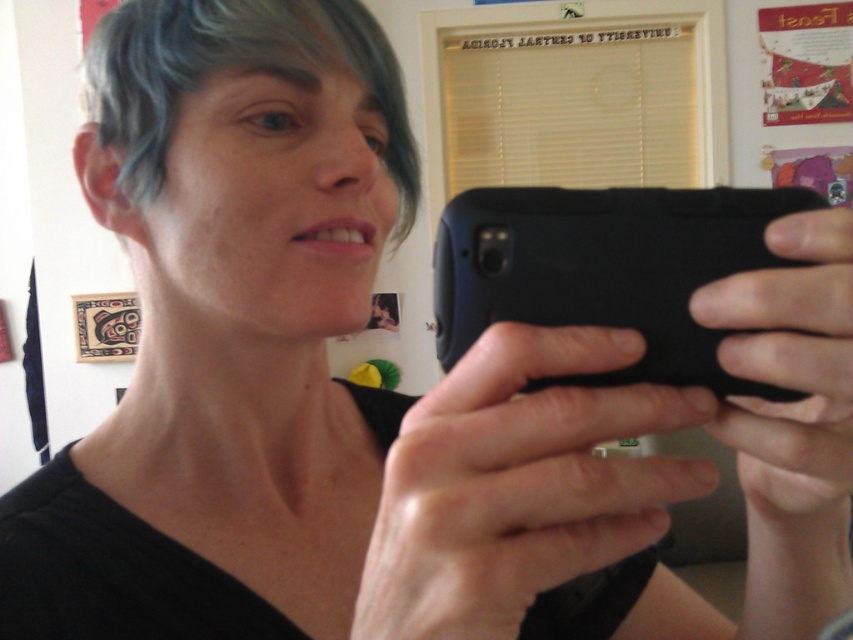
You are trying to locate the black matte phone at center in the image. What are the coordinates of its position?

The black matte phone at center is located at coordinates point (606, 269).

You are a photographer trying to capture a closeup shot of the black matte phone at center and the gray matte hair at upper left. Which object should you zoom in on to ensure both fit in the frame without cropping?

The black matte phone at center has a smaller width compared to the gray matte hair at upper left. To ensure both fit in the frame without cropping, you should zoom in on the gray matte hair at upper left since it is wider and requires more space.